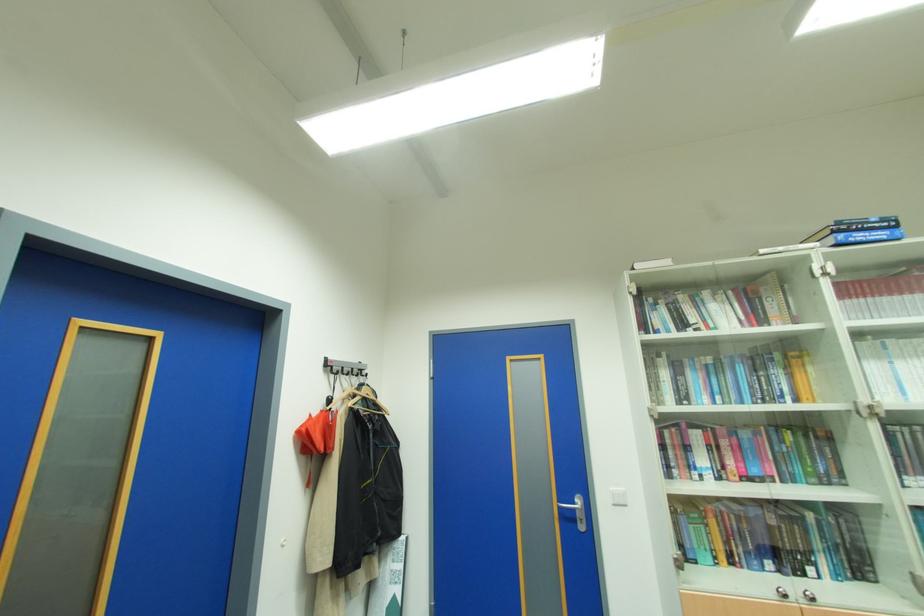
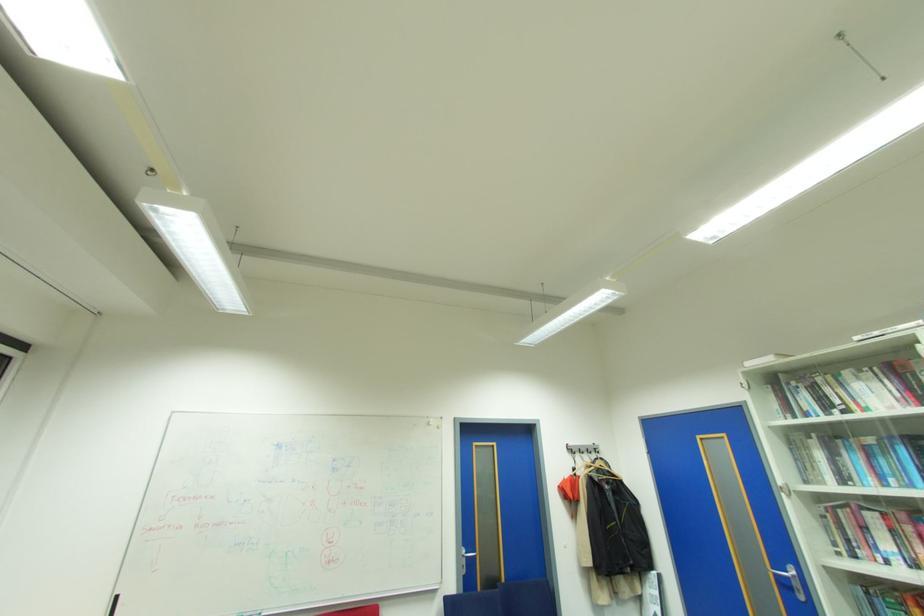
Locate, in the second image, the point that corresponds to pixel 365 371 in the first image.

(600, 448)